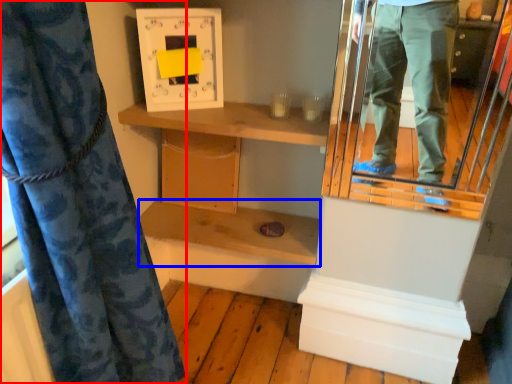
Question: Among these objects, which one is nearest to the camera, curtain (highlighted by a red box) or shelf (highlighted by a blue box)?

Choices:
 (A) curtain
 (B) shelf

Answer: (A)